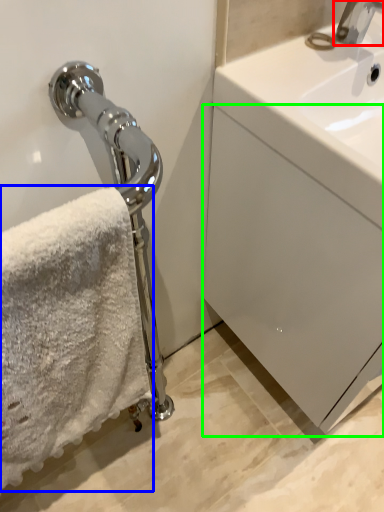
Question: Which object is positioned closest to tap (highlighted by a red box)? Select from towel (highlighted by a blue box) and drawer (highlighted by a green box).

Choices:
 (A) towel
 (B) drawer

Answer: (B)